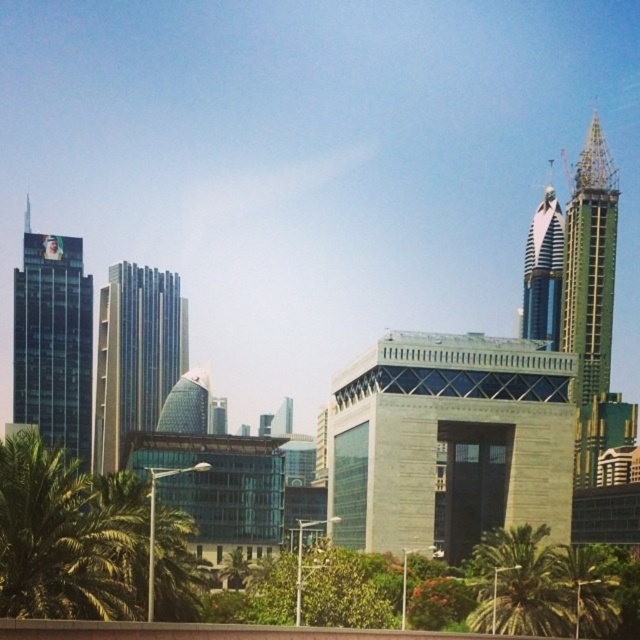
You are a city planner assessing the urban layout. Based on the image, which object occupies more horizontal space in the scene? Please consider the black glass building at left and the green leafy palm tree at lower right.

The black glass building at left might be wider than green leafy palm tree at lower right, so it likely occupies more horizontal space in the scene.

You are an architect analyzing the urban skyline. You notice two structures at the upper right corner of the image. Which one is located more to the right side between the green glass tower at upper right and the glass skyscraper at upper right?

The green glass tower at upper right is positioned on the right side of the glass skyscraper at upper right, so it is more to the right.

You are a drone operator who needs to fly a drone between the black glass building at left and the glass skyscraper at upper right. The drone has a maximum flight distance of 500 feet. Can the drone safely make this flight without exceeding its range?

The black glass building at left and the glass skyscraper at upper right are 522.09 feet apart from each other. Since the drone can only fly up to 500 feet, it cannot safely make the flight without exceeding its range.